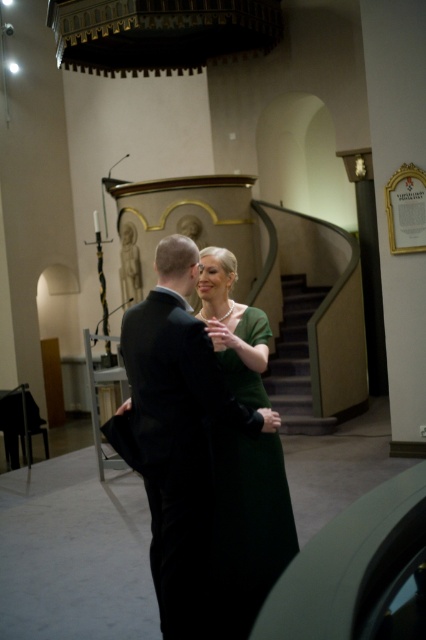
Question: Which of the following is the farthest from the observer?

Choices:
 (A) wooden staircase at center
 (B) green matte dress at center

Answer: (A)

Question: Can you confirm if green matte dress at center is positioned to the left of wooden staircase at center?

Choices:
 (A) yes
 (B) no

Answer: (A)

Question: Does green matte dress at center lie in front of wooden staircase at center?

Choices:
 (A) yes
 (B) no

Answer: (A)

Question: Which point is closer to the camera?

Choices:
 (A) (293, 422)
 (B) (170, 538)
 (C) (226, 376)

Answer: (B)

Question: Does black velvet suit at center come in front of green matte dress at center?

Choices:
 (A) yes
 (B) no

Answer: (A)

Question: Among these objects, which one is nearest to the camera?

Choices:
 (A) wooden staircase at center
 (B) green matte dress at center
 (C) black velvet suit at center

Answer: (C)